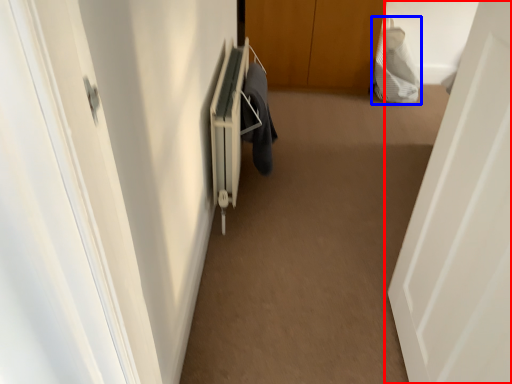
Question: Which of the following is the farthest to the observer, door (highlighted by a red box) or material (highlighted by a blue box)?

Choices:
 (A) door
 (B) material

Answer: (B)